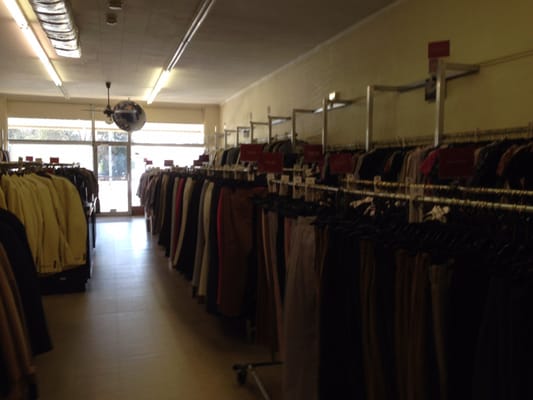
The image size is (533, 400). What are the coordinates of `bracket` in the screenshot? It's located at (374, 115).